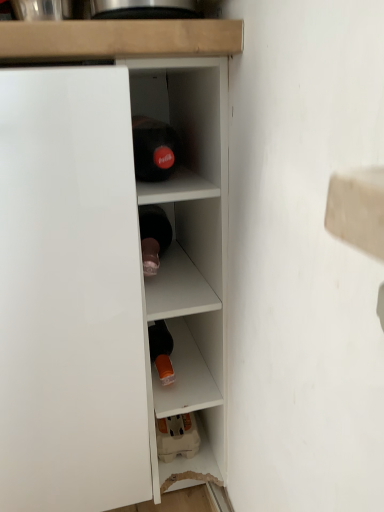
Question: Considering the positions of white glossy cupboard at left and white glossy cabinet at center in the image, is white glossy cupboard at left taller or shorter than white glossy cabinet at center?

Choices:
 (A) tall
 (B) short

Answer: (B)

Question: From the image's perspective, is white glossy cupboard at left above or below white glossy cabinet at center?

Choices:
 (A) below
 (B) above

Answer: (A)

Question: Looking at the image, does white glossy cupboard at left seem bigger or smaller compared to white glossy cabinet at center?

Choices:
 (A) small
 (B) big

Answer: (B)

Question: Considering the positions of white glossy cabinet at center and white glossy cupboard at left in the image, is white glossy cabinet at center wider or thinner than white glossy cupboard at left?

Choices:
 (A) thin
 (B) wide

Answer: (A)

Question: Visually, is white glossy cabinet at center positioned to the left or to the right of white glossy cupboard at left?

Choices:
 (A) left
 (B) right

Answer: (B)

Question: Considering the positions of point (205, 442) and point (39, 273), is point (205, 442) closer or farther from the camera than point (39, 273)?

Choices:
 (A) farther
 (B) closer

Answer: (A)

Question: Considering the positions of white glossy cabinet at center and white glossy cupboard at left in the image, is white glossy cabinet at center taller or shorter than white glossy cupboard at left?

Choices:
 (A) tall
 (B) short

Answer: (A)